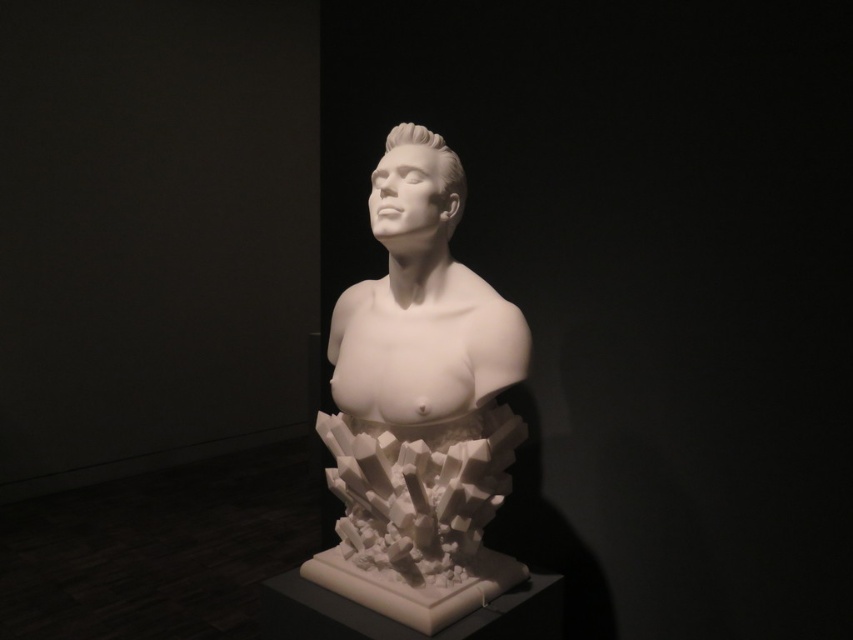
You are an art curator planning to install a protective glass case around the sculpture. The case must accommodate both the white marble bust at center and the white glossy head at center. Given that the case has a fixed width, which object should determine the minimum required width of the case?

The white marble bust at center has a greater width than the white glossy head at center, so the case must be at least as wide as the white marble bust at center to accommodate both objects.

You are an art curator planning to move the white marble bust at center and the white glossy head at center to a new exhibition space. The new space has a narrow corridor that can only accommodate items placed side by side if they are aligned from left to right. Based on their current arrangement in the image, which object should be placed to the left to fit through the corridor?

The white marble bust at center should be placed to the left since it is already positioned on the left side of the white glossy head at center in the current arrangement, making it easier to maintain their alignment for the narrow corridor.